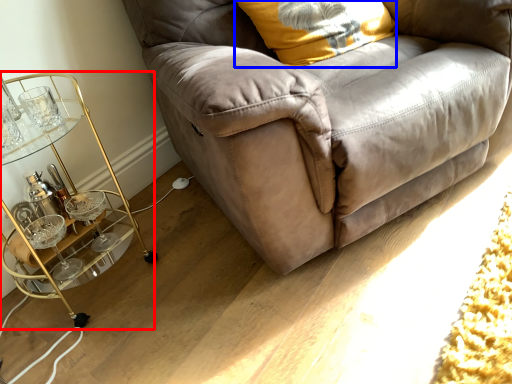
Question: Among these objects, which one is farthest to the camera, table (highlighted by a red box) or pillow (highlighted by a blue box)?

Choices:
 (A) table
 (B) pillow

Answer: (B)